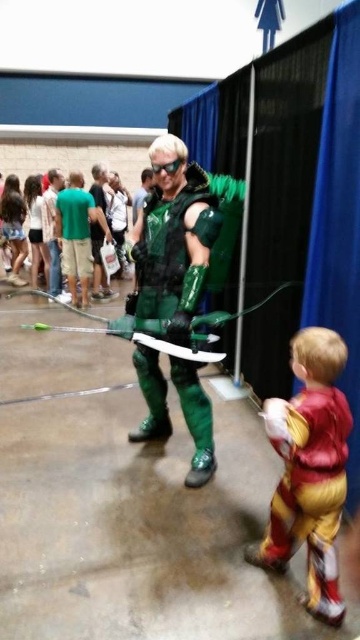
Consider the image. You are organizing a photo shoot for a superhero magazine. You need to arrange the shiny yellow costume at lower right and the green metallic armor at center in a way that highlights their sizes. Which costume should you place closer to the camera to make them appear equally sized in the photo?

The shiny yellow costume at lower right is smaller in size compared to the green metallic armor at center. To make them appear equally sized in the photo, place the shiny yellow costume at lower right closer to the camera and move the green metallic armor at center further back.

You are standing at the point labeled point (101, 202) and want to move to the point labeled point (316, 420). Is there a clear path between these two points without any obstacles?

Yes, there is a clear path between point (101, 202) and point (316, 420) because point (316, 420) is in front of point (101, 202), indicating they are aligned along the same line of sight without obstruction.